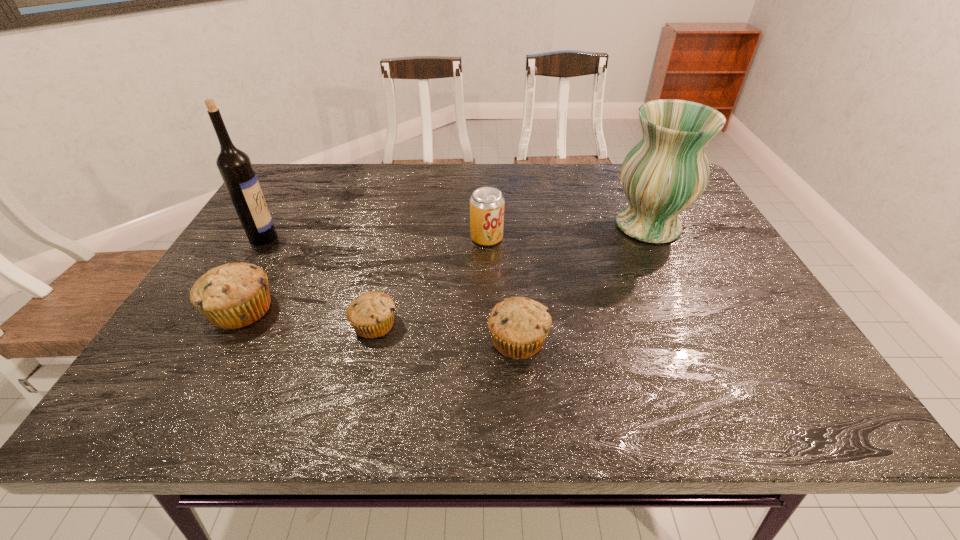
Where is `free space at the near edge`? free space at the near edge is located at coordinates (341, 362).

Find the location of a particular element. vacant point at the left edge is located at coordinates (203, 335).

Locate an element on the screen. The height and width of the screenshot is (540, 960). vacant area at the far left corner is located at coordinates tap(312, 165).

The width and height of the screenshot is (960, 540). What are the coordinates of `free space at the near left corner of the desktop` in the screenshot? It's located at (223, 358).

This screenshot has height=540, width=960. In the image, there is a desktop. In order to click on vacant area at the near right corner in this screenshot , I will do `click(752, 343)`.

What are the coordinates of `empty space that is in between the second shortest muffin and the wine bottle` in the screenshot? It's located at (391, 289).

What are the coordinates of `vacant area that lies between the rightmost object and the wine bottle` in the screenshot? It's located at (456, 232).

Where is `empty space between the wine bottle and the second tallest object`? Image resolution: width=960 pixels, height=540 pixels. empty space between the wine bottle and the second tallest object is located at coordinates (456, 232).

Identify the location of blank region between the third object from left to right and the leftmost muffin. The width and height of the screenshot is (960, 540). (308, 318).

Image resolution: width=960 pixels, height=540 pixels. Identify the location of vacant space that's between the shortest object and the wine bottle. (319, 281).